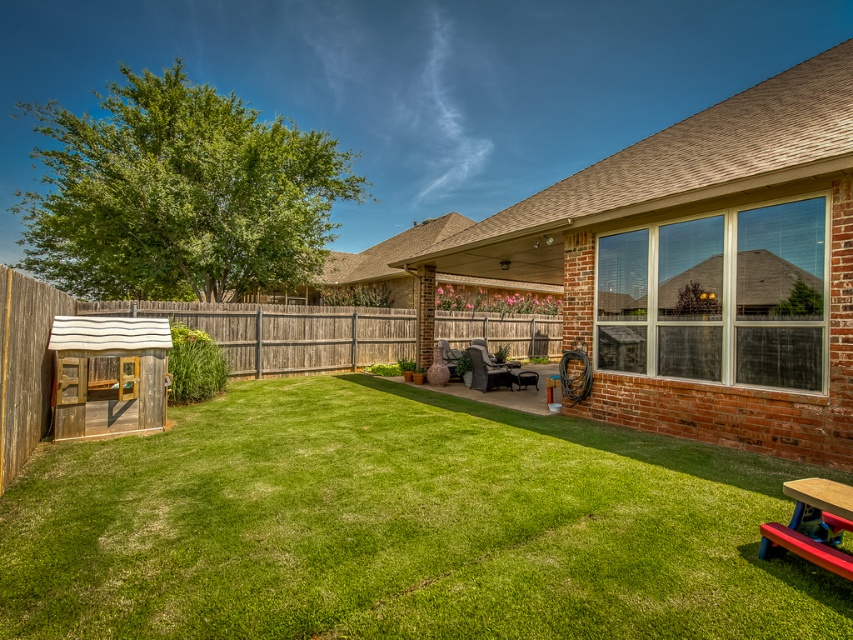
Measure the distance between point (599, 529) and camera.

Point (599, 529) and camera are 4.11 meters apart from each other.

Can you confirm if green grass at center is wider than wooden fence at left?

Incorrect, green grass at center's width does not surpass wooden fence at left's.

Describe the element at coordinates (401, 525) in the screenshot. The width and height of the screenshot is (853, 640). I see `green grass at center` at that location.

Find the location of `green grass at center`. green grass at center is located at coordinates (401, 525).

Who is taller, green grass at center or wooden fence at center?

Standing taller between the two is wooden fence at center.

Who is shorter, green grass at center or wooden fence at center?

green grass at center

Who is more forward, (x=589, y=572) or (x=386, y=317)?

Positioned in front is point (x=589, y=572).

The height and width of the screenshot is (640, 853). I want to click on green grass at center, so click(401, 525).

Who is shorter, wooden fence at left or red plastic picnic table at lower right?

With less height is red plastic picnic table at lower right.

Between point (45, 291) and point (799, 484), which one is positioned behind?

The point (45, 291) is more distant.

I want to click on wooden fence at left, so click(144, 316).